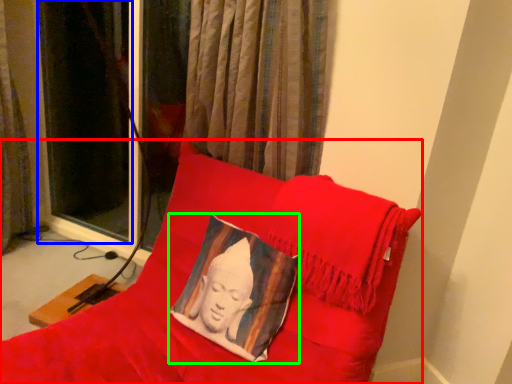
Question: Which object is the closest to the furniture (highlighted by a red box)? Choose among these: curtain (highlighted by a blue box) or pillow (highlighted by a green box).

Choices:
 (A) curtain
 (B) pillow

Answer: (B)